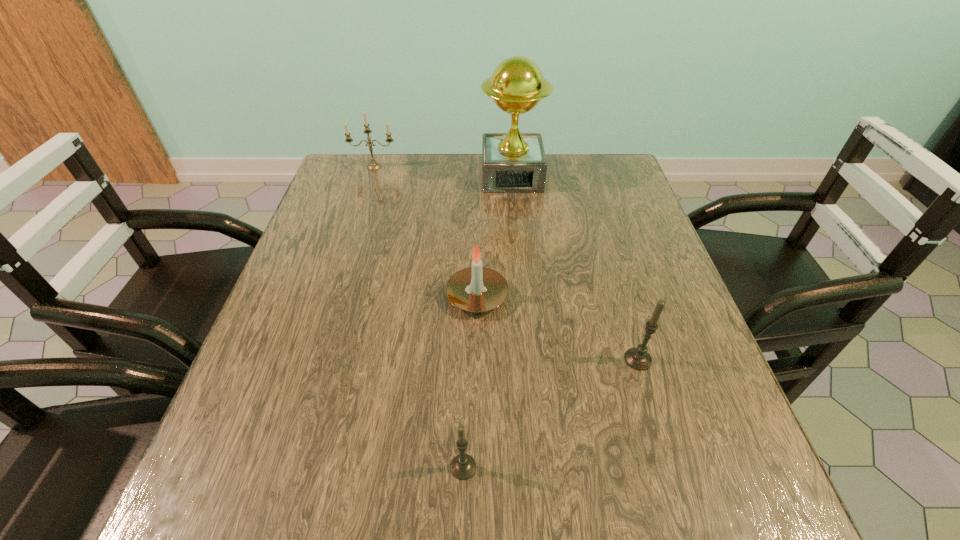
The width and height of the screenshot is (960, 540). In order to click on vacant space at the left edge of the desktop in this screenshot , I will do (287, 379).

At what (x,y) coordinates should I click in order to perform the action: click on vacant space at the right edge. Please return your answer as a coordinate pair (x, y). The height and width of the screenshot is (540, 960). Looking at the image, I should click on (710, 390).

Where is `vacant region at the far left corner of the desktop`? This screenshot has width=960, height=540. vacant region at the far left corner of the desktop is located at coordinates (362, 181).

Where is `free space at the near left corner of the desktop`? The height and width of the screenshot is (540, 960). free space at the near left corner of the desktop is located at coordinates (252, 515).

Find the location of a particular element. This screenshot has width=960, height=540. vacant space at the far right corner of the desktop is located at coordinates (590, 179).

Where is `vacant region between the nearest candle and the tallest object`? The image size is (960, 540). vacant region between the nearest candle and the tallest object is located at coordinates (488, 322).

This screenshot has width=960, height=540. In order to click on unoccupied position between the nearest object and the rightmost candle in this screenshot , I will do `click(551, 413)`.

Where is `vacant point located between the tallest object and the nearest candle`? Image resolution: width=960 pixels, height=540 pixels. vacant point located between the tallest object and the nearest candle is located at coordinates (488, 322).

Image resolution: width=960 pixels, height=540 pixels. In order to click on free space between the tallest object and the nearest object in this screenshot , I will do `click(488, 322)`.

This screenshot has width=960, height=540. I want to click on free spot between the third nearest candle and the award, so click(494, 237).